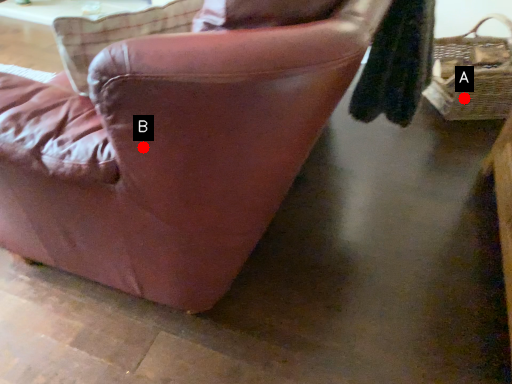
Question: Two points are circled on the image, labeled by A and B beside each circle. Among these points, which one is nearest to the camera?

Choices:
 (A) A is closer
 (B) B is closer

Answer: (B)